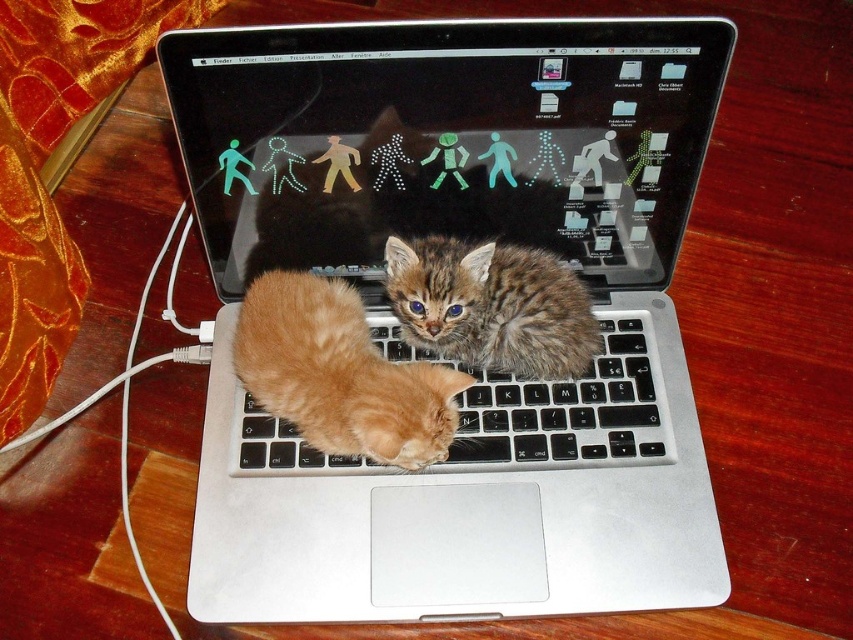
You are a photographer trying to capture a closeup of the kittens resting on the laptop keyboard. You notice two specific points on the keyboard marked as point 1 at coordinates point [650,387] and point 2 at coordinates point [548,294]. Which point should you focus on to ensure the kitten closer to the viewer is in sharp focus?

Point [650,387] is further to the viewer than point [548,294]. Therefore, focusing on point [650,387] will ensure the kitten closer to the viewer is in sharp focus.

You are a photographer standing at a certain distance from the silver metallic laptop at center. You want to take a clear photo of the laptop without any blur. The camera you are using has a focus range of 30 to 40 inches. Can you take the photo from your current position?

The silver metallic laptop at center and camera are 38.59 inches apart. Since the camera has a focus range of 30 to 40 inches, the distance of 38.59 inches falls within this range. Therefore, you can take a clear photo of the silver metallic laptop at center without any blur from your current position.

You are a photographer trying to capture a clear photo of the silver metallic laptop at center without the tabby fur at center blocking the view. Based on their positions, is this possible?

The silver metallic laptop at center is located above the tabby fur at center, so you can take a clear photo of the silver metallic laptop at center without the tabby fur at center blocking the view by angling the camera slightly downward.